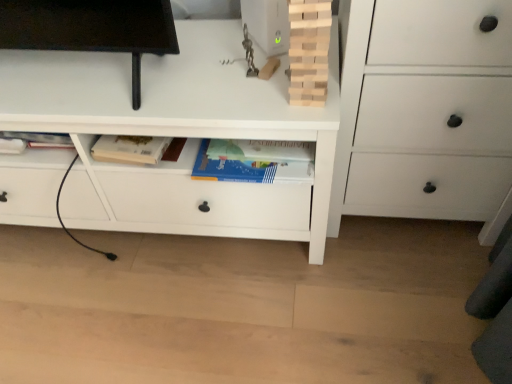
Identify the location of free spot to the left of natural wood tower at upper center. The height and width of the screenshot is (384, 512). (240, 96).